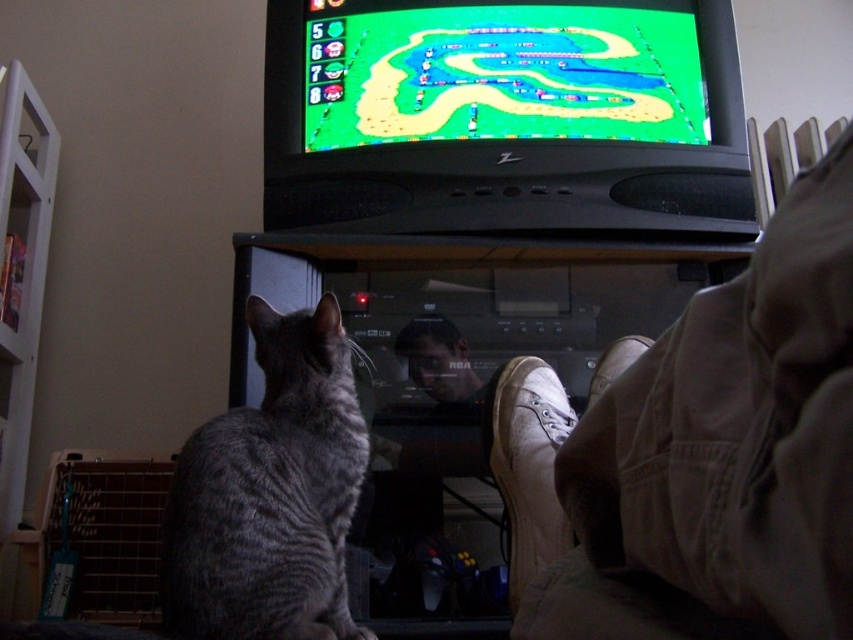
Which is more to the left, green matte track at upper center or smooth skin face at center?

smooth skin face at center

Between green matte track at upper center and smooth skin face at center, which one appears on the right side from the viewer's perspective?

Positioned to the right is green matte track at upper center.

Where is `green matte track at upper center`? This screenshot has width=853, height=640. green matte track at upper center is located at coordinates (502, 74).

Does gray fur cat at lower left have a larger size compared to white canvas shoe at lower right?

Indeed, gray fur cat at lower left has a larger size compared to white canvas shoe at lower right.

Which is in front, point (190, 600) or point (488, 422)?

Point (190, 600)

Find the location of a particular element. This screenshot has width=853, height=640. gray fur cat at lower left is located at coordinates (270, 493).

The height and width of the screenshot is (640, 853). In order to click on gray fur cat at lower left in this screenshot , I will do `click(270, 493)`.

Between green matte track at upper center and white canvas shoe at lower right, which one appears on the left side from the viewer's perspective?

From the viewer's perspective, green matte track at upper center appears more on the left side.

Is the position of green matte track at upper center more distant than that of white canvas shoe at lower right?

Yes, it is.

Identify the location of green matte track at upper center. Image resolution: width=853 pixels, height=640 pixels. (502, 74).

Locate an element on the screen. The height and width of the screenshot is (640, 853). green matte track at upper center is located at coordinates (502, 74).